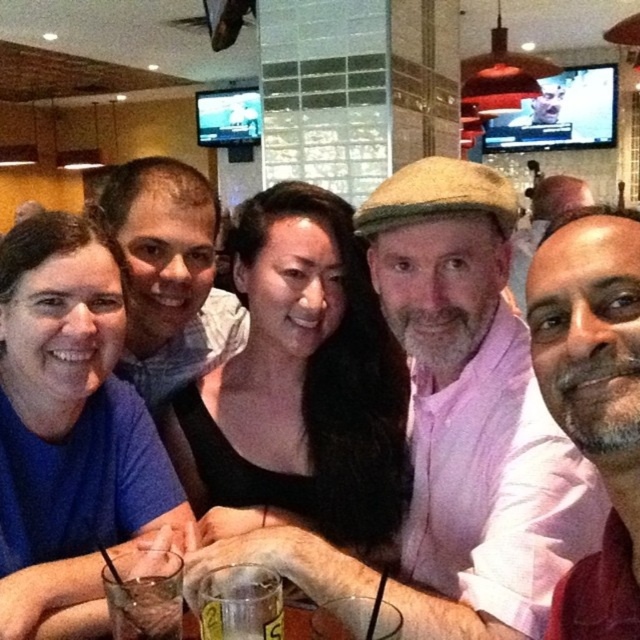
Who is lower down, blue shirt at left or matte gray shirt at center?

blue shirt at left is below.

Measure the distance between point [16,433] and camera.

The distance of point [16,433] from camera is 1.12 meters.

I want to click on blue shirt at left, so click(68, 422).

Which is more to the right, gray beard at center or clear glass at center?

From the viewer's perspective, gray beard at center appears more on the right side.

Between gray beard at center and clear glass at center, which one has more height?

Standing taller between the two is gray beard at center.

Is point (614, 317) closer to viewer compared to point (173, 582)?

Yes, point (614, 317) is in front of point (173, 582).

Image resolution: width=640 pixels, height=640 pixels. Find the location of `gray beard at center`. gray beard at center is located at coordinates (593, 401).

Can you confirm if pink cotton shirt at center is positioned below matte gray shirt at center?

Correct, pink cotton shirt at center is located below matte gray shirt at center.

Is pink cotton shirt at center to the right of matte gray shirt at center from the viewer's perspective?

Indeed, pink cotton shirt at center is positioned on the right side of matte gray shirt at center.

This screenshot has width=640, height=640. What are the coordinates of `pink cotton shirt at center` in the screenshot? It's located at (472, 412).

Image resolution: width=640 pixels, height=640 pixels. I want to click on pink cotton shirt at center, so click(x=472, y=412).